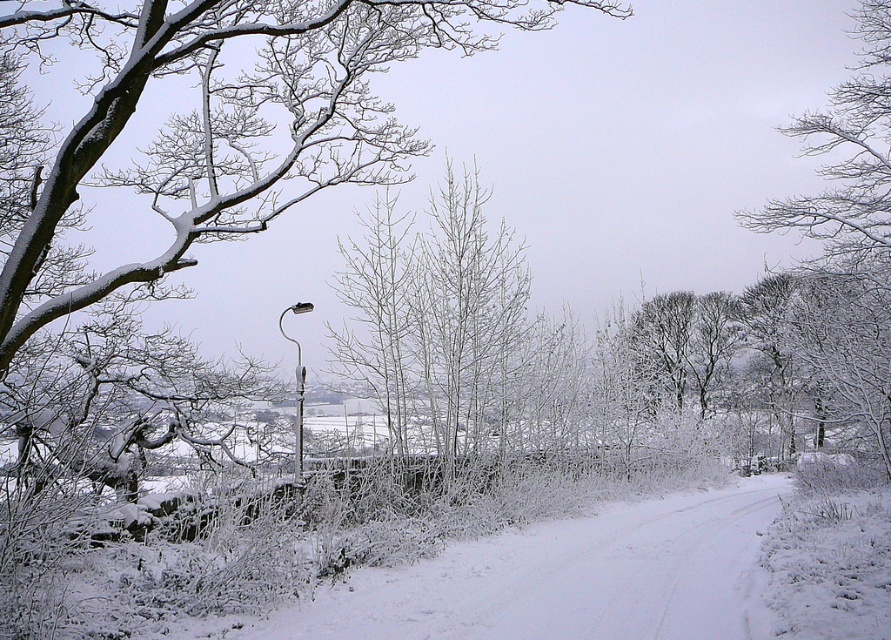
Question: Is the position of snow-covered branches at upper left more distant than that of white frosty branches at upper right?

Choices:
 (A) no
 (B) yes

Answer: (A)

Question: Does snow-covered branches at upper left appear on the right side of white frosty branches at upper right?

Choices:
 (A) yes
 (B) no

Answer: (B)

Question: Does snow-covered branches at upper left have a smaller size compared to white frosty branches at upper right?

Choices:
 (A) no
 (B) yes

Answer: (A)

Question: Which object appears farthest from the camera in this image?

Choices:
 (A) white frosty branches at upper right
 (B) snow-covered branches at upper left

Answer: (A)